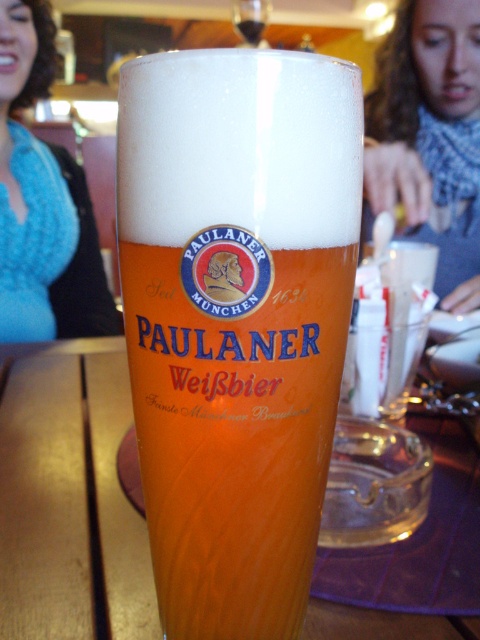
Who is positioned more to the left, matte glass beer at center or blue knitted sweater at upper left?

blue knitted sweater at upper left

Is matte glass beer at center taller than blue knitted sweater at upper left?

Incorrect, matte glass beer at center's height is not larger of blue knitted sweater at upper left's.

Is point (299, 621) behind point (19, 26)?

No, (299, 621) is in front of (19, 26).

The width and height of the screenshot is (480, 640). I want to click on matte glass beer at center, so click(236, 320).

Which is below, wooden table at center or blue knitted scarf at upper center?

wooden table at center is lower down.

Is wooden table at center further to the viewer compared to blue knitted scarf at upper center?

No, wooden table at center is in front of blue knitted scarf at upper center.

Does point (116, 524) come closer to viewer compared to point (380, 145)?

Yes, it is in front of point (380, 145).

Find the location of a particular element. Image resolution: width=480 pixels, height=640 pixels. wooden table at center is located at coordinates tap(69, 497).

Does point (127, 419) lie in front of point (108, 292)?

Yes.

Does point (90, 573) lie behind point (72, 163)?

No, (90, 573) is in front of (72, 163).

Is point (49, 563) positioned after point (79, 228)?

That is False.

Find the location of a particular element. wooden table at center is located at coordinates (69, 497).